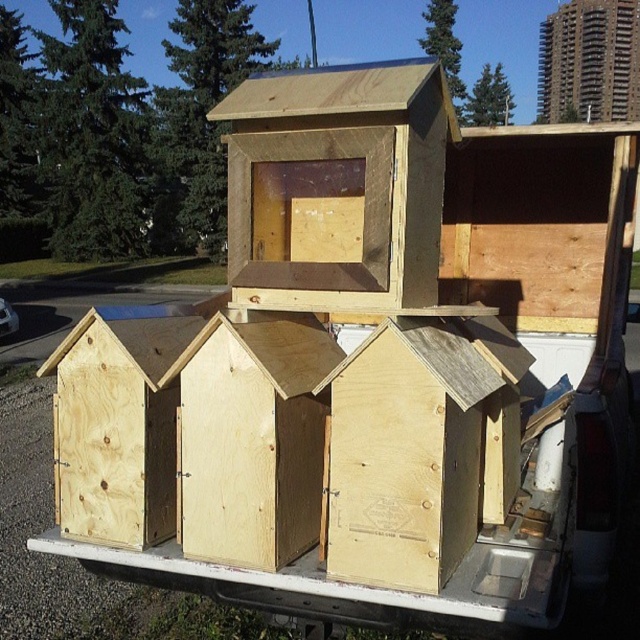
Between point (369, 528) and point (636, 1), which one is positioned behind?

The point (636, 1) is more distant.

Does light brown wood birdhouse at center have a lesser height compared to matte wood birdhouse at upper center?

Yes.

This screenshot has width=640, height=640. Describe the element at coordinates (419, 448) in the screenshot. I see `light brown wood birdhouse at center` at that location.

Locate an element on the screen. The height and width of the screenshot is (640, 640). light brown wood birdhouse at center is located at coordinates (419, 448).

Is light brown wood birdhouse at center bigger than plywood hut at lower left?

Yes, light brown wood birdhouse at center is bigger than plywood hut at lower left.

Can you confirm if light brown wood birdhouse at center is smaller than plywood hut at lower left?

No, light brown wood birdhouse at center is not smaller than plywood hut at lower left.

The width and height of the screenshot is (640, 640). Describe the element at coordinates (419, 448) in the screenshot. I see `light brown wood birdhouse at center` at that location.

You are a GUI agent. You are given a task and a screenshot of the screen. Output one action in this format:
    pyautogui.click(x=<x>, y=<y>)
    Task: Click on the light brown wood birdhouse at center
    
    Given the screenshot: What is the action you would take?
    pyautogui.click(x=419, y=448)

Which is more to the left, natural wood birdhouse at center or plywood hut at center?

From the viewer's perspective, plywood hut at center appears more on the left side.

Who is more distant from viewer, (362, 304) or (236, 358)?

The point (236, 358) is more distant.

Measure the distance between natural wood birdhouse at center and camera.

natural wood birdhouse at center and camera are 6.65 feet apart.

You are a GUI agent. You are given a task and a screenshot of the screen. Output one action in this format:
    pyautogui.click(x=<x>, y=<y>)
    Task: Click on the natural wood birdhouse at center
    The height and width of the screenshot is (640, 640).
    Given the screenshot: What is the action you would take?
    pyautogui.click(x=339, y=179)